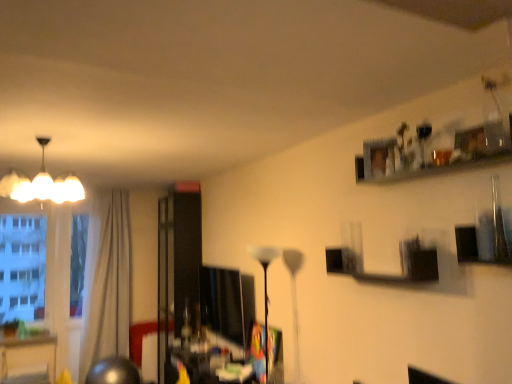
Identify the location of transparent glass window at left. (22, 267).

What are the coordinates of `matte black monitor at center` in the screenshot? It's located at (227, 303).

This screenshot has width=512, height=384. What do you see at coordinates (177, 264) in the screenshot?
I see `transparent glass door at center` at bounding box center [177, 264].

The height and width of the screenshot is (384, 512). What do you see at coordinates (110, 302) in the screenshot? I see `beige fabric curtain at left` at bounding box center [110, 302].

I want to click on white glossy floor lamp at center, acting as the 2th lamp starting from the top, so click(x=265, y=287).

Is white glossy chandelier at upper left, the 1th lamp in the left-to-right sequence, situated inside transparent glass door at center or outside?

white glossy chandelier at upper left, the 1th lamp in the left-to-right sequence, is not inside transparent glass door at center, it's outside.

Which of these two, white glossy chandelier at upper left, the second lamp from the right, or transparent glass door at center, is smaller?

Smaller between the two is white glossy chandelier at upper left, the second lamp from the right.

Between white glossy chandelier at upper left, the 1th lamp in the left-to-right sequence, and transparent glass door at center, which one is positioned behind?

transparent glass door at center is behind.

Is white glossy chandelier at upper left, the second lamp ordered from the bottom, facing away from transparent glass door at center?

white glossy chandelier at upper left, the second lamp ordered from the bottom, does not have its back to transparent glass door at center.

Is white glossy floor lamp at center, which ranks as the first lamp in bottom-to-top order, oriented towards beige fabric curtain at left?

No, white glossy floor lamp at center, which ranks as the first lamp in bottom-to-top order, does not turn towards beige fabric curtain at left.

Based on their sizes in the image, would you say white glossy floor lamp at center, which ranks as the first lamp in bottom-to-top order, is bigger or smaller than beige fabric curtain at left?

white glossy floor lamp at center, which ranks as the first lamp in bottom-to-top order, is smaller than beige fabric curtain at left.

In terms of height, does white glossy floor lamp at center, acting as the 2th lamp starting from the top, look taller or shorter compared to beige fabric curtain at left?

In the image, white glossy floor lamp at center, acting as the 2th lamp starting from the top, appears to be shorter than beige fabric curtain at left.

In order to click on curtain lying behind the white glossy floor lamp at center, which ranks as the 2th lamp in left-to-right order in this screenshot , I will do `click(110, 302)`.

Which of these two, transparent glass door at center or transparent glass window at left, stands taller?

transparent glass door at center.

How far apart are transparent glass door at center and transparent glass window at left?

transparent glass door at center and transparent glass window at left are 6.13 feet apart.

Is transparent glass door at center not within transparent glass window at left?

Indeed, transparent glass door at center is completely outside transparent glass window at left.

Consider the image. Is matte black monitor at center facing towards white glossy floor lamp at center, acting as the 2th lamp starting from the top?

No.

Is matte black monitor at center in front of or behind white glossy floor lamp at center, which ranks as the first lamp in bottom-to-top order, in the image?

matte black monitor at center is behind white glossy floor lamp at center, which ranks as the first lamp in bottom-to-top order.

Is matte black monitor at center positioned beyond the bounds of white glossy floor lamp at center, which ranks as the 2th lamp in left-to-right order?

matte black monitor at center is positioned outside white glossy floor lamp at center, which ranks as the 2th lamp in left-to-right order.

Based on the photo, is matte black monitor at center touching white glossy floor lamp at center, which ranks as the first lamp in bottom-to-top order?

No, matte black monitor at center is not next to white glossy floor lamp at center, which ranks as the first lamp in bottom-to-top order.

From a real-world perspective, does white glossy floor lamp at center, which ranks as the first lamp in bottom-to-top order, sit lower than white glossy chandelier at upper left, the first lamp when ordered from top to bottom?

Yes, from a real-world perspective, white glossy floor lamp at center, which ranks as the first lamp in bottom-to-top order, is under white glossy chandelier at upper left, the first lamp when ordered from top to bottom.

Is white glossy floor lamp at center, which ranks as the 2th lamp in left-to-right order, in contact with white glossy chandelier at upper left, the second lamp ordered from the bottom?

There is a gap between white glossy floor lamp at center, which ranks as the 2th lamp in left-to-right order, and white glossy chandelier at upper left, the second lamp ordered from the bottom.

Is white glossy floor lamp at center, acting as the 2th lamp starting from the top, to the right of white glossy chandelier at upper left, the first lamp when ordered from top to bottom, from the viewer's perspective?

Yes, white glossy floor lamp at center, acting as the 2th lamp starting from the top, is to the right of white glossy chandelier at upper left, the first lamp when ordered from top to bottom.

Which object is further away from the camera, white glossy floor lamp at center, acting as the 2th lamp starting from the top, or white glossy chandelier at upper left, the second lamp from the right?

white glossy floor lamp at center, acting as the 2th lamp starting from the top.

Between white glossy floor lamp at center, acting as the 2th lamp starting from the top, and transparent glass door at center, which one has larger width?

With larger width is transparent glass door at center.

Locate an element on the screen. The height and width of the screenshot is (384, 512). lamp on the right of transparent glass door at center is located at coordinates (265, 287).

Is white glossy floor lamp at center, acting as the 2th lamp starting from the top, closer to camera compared to transparent glass door at center?

Yes, the depth of white glossy floor lamp at center, acting as the 2th lamp starting from the top, is less than that of transparent glass door at center.

Visually, is beige fabric curtain at left positioned to the left or to the right of matte black monitor at center?

beige fabric curtain at left is positioned on matte black monitor at center's left side.

From a real-world perspective, who is located lower, beige fabric curtain at left or matte black monitor at center?

matte black monitor at center.

Which of these two, beige fabric curtain at left or matte black monitor at center, is smaller?

matte black monitor at center.

Is beige fabric curtain at left further to camera compared to matte black monitor at center?

Yes, beige fabric curtain at left is further from the viewer.

In order to click on glass door located behind the white glossy chandelier at upper left, the 1th lamp in the left-to-right sequence in this screenshot , I will do `click(177, 264)`.

I want to click on the 2nd lamp to the right when counting from the beige fabric curtain at left, so click(265, 287).

Estimate the real-world distances between objects in this image. Which object is further from matte black monitor at center, beige fabric curtain at left or white glossy chandelier at upper left, the 1th lamp in the left-to-right sequence?

The object further to matte black monitor at center is beige fabric curtain at left.

Looking at the image, which one is located further to transparent glass window at left, matte black monitor at center or white glossy floor lamp at center, which ranks as the first lamp in bottom-to-top order?

Based on the image, white glossy floor lamp at center, which ranks as the first lamp in bottom-to-top order, appears to be further to transparent glass window at left.

From the picture: Considering their positions, is matte black monitor at center positioned further to white glossy chandelier at upper left, the second lamp ordered from the bottom, than white glossy floor lamp at center, which ranks as the 2th lamp in left-to-right order?

The object further to white glossy chandelier at upper left, the second lamp ordered from the bottom, is matte black monitor at center.

When comparing their distances from transparent glass window at left, does beige fabric curtain at left or white glossy chandelier at upper left, the second lamp ordered from the bottom, seem closer?

beige fabric curtain at left is positioned closer to the anchor transparent glass window at left.

Considering their positions, is white glossy floor lamp at center, which ranks as the 2th lamp in left-to-right order, positioned further to beige fabric curtain at left than matte black monitor at center?

The object further to beige fabric curtain at left is white glossy floor lamp at center, which ranks as the 2th lamp in left-to-right order.

When comparing their distances from transparent glass window at left, does beige fabric curtain at left or matte black monitor at center seem further?

Among the two, matte black monitor at center is located further to transparent glass window at left.

Estimate the real-world distances between objects in this image. Which object is closer to transparent glass window at left, white glossy chandelier at upper left, the 1th lamp in the left-to-right sequence, or transparent glass door at center?

Based on the image, transparent glass door at center appears to be nearer to transparent glass window at left.

Which object lies further to the anchor point white glossy floor lamp at center, which ranks as the first lamp in bottom-to-top order, matte black monitor at center or transparent glass door at center?

transparent glass door at center.

Image resolution: width=512 pixels, height=384 pixels. In order to click on glass door between white glossy floor lamp at center, which ranks as the 2th lamp in left-to-right order, and beige fabric curtain at left in the front-back direction in this screenshot , I will do `click(177, 264)`.

You are a GUI agent. You are given a task and a screenshot of the screen. Output one action in this format:
    pyautogui.click(x=<x>, y=<y>)
    Task: Click on the glass door between white glossy chandelier at upper left, the 1th lamp in the left-to-right sequence, and transparent glass window at left in the front-back direction
    
    Given the screenshot: What is the action you would take?
    pyautogui.click(x=177, y=264)

The height and width of the screenshot is (384, 512). Identify the location of lamp between white glossy chandelier at upper left, the 1th lamp in the left-to-right sequence, and beige fabric curtain at left from front to back. (265, 287).

You are a GUI agent. You are given a task and a screenshot of the screen. Output one action in this format:
    pyautogui.click(x=<x>, y=<y>)
    Task: Click on the computer monitor positioned between white glossy chandelier at upper left, the second lamp from the right, and transparent glass window at left from near to far
    This screenshot has width=512, height=384.
    Given the screenshot: What is the action you would take?
    pyautogui.click(x=227, y=303)